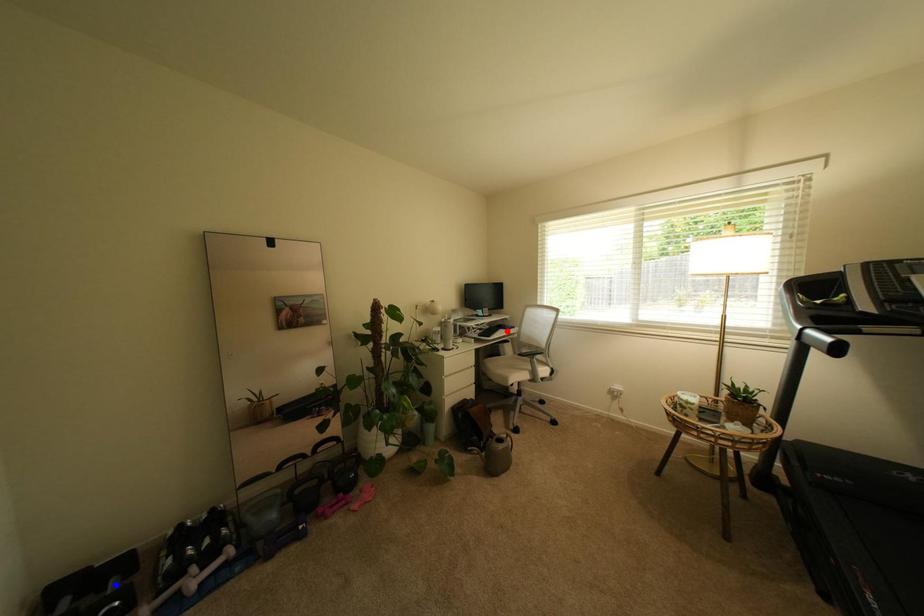
Question: Which of the two points in the image is closer to the camera?

Choices:
 (A) Blue point is closer.
 (B) Red point is closer.

Answer: (A)